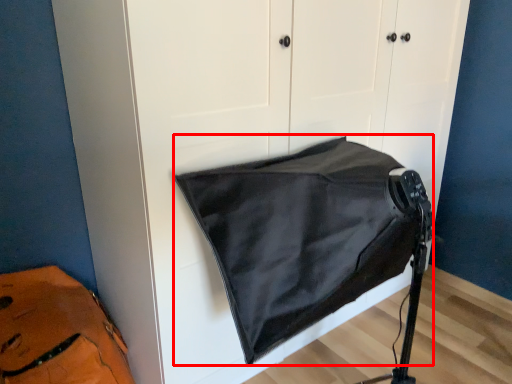
Question: From the image's perspective, where is sleeping bag (annotated by the red box) located relative to messenger bag?

Choices:
 (A) above
 (B) below

Answer: (A)